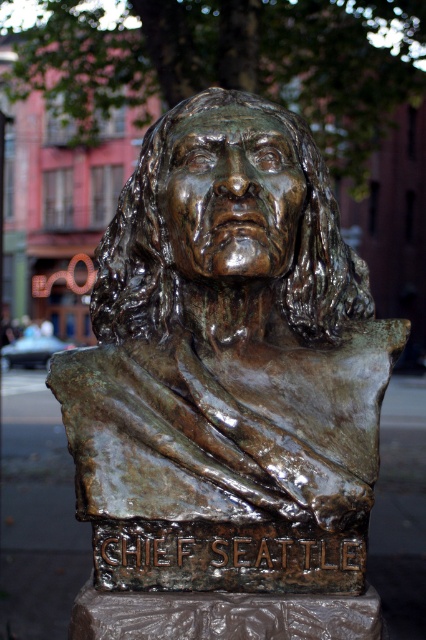
You are standing in front of the Chief Seattle sculpture. There are two points marked on the sculpture. One is at coordinate point (118, 536) and the other is at point (247, 244). Which point is closer to you?

Point (118, 536) is in front of point (247, 244), so it is closer to you.

You are a tour guide pointing out landmarks in the city. You see the bronze statue at center and the bronze bust at center. Which one is located to the left?

The bronze statue at center is located to the left of the bronze bust at center.

You are an art student trying to sketch the Chief Seattle sculpture. You notice two bronze pieces at the center. Which one is wider? The bronze statue at center or the bronze bust at center?

The bronze statue at center is wider than the bronze bust at center.